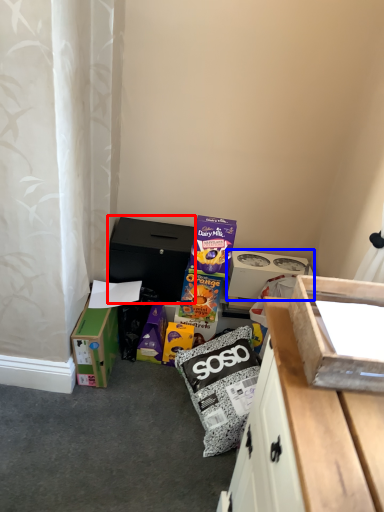
Question: Which of the following is the farthest to the observer, cardboard box (highlighted by a red box) or box (highlighted by a blue box)?

Choices:
 (A) cardboard box
 (B) box

Answer: (B)